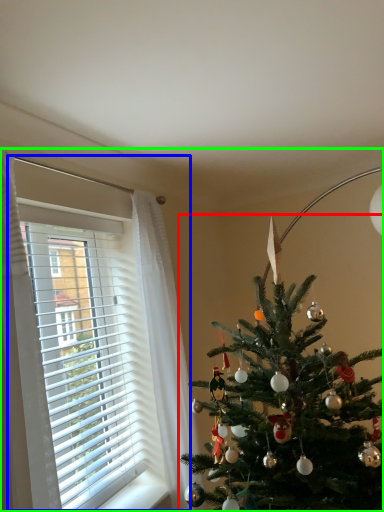
Question: Which object is the farthest from christmas tree (highlighted by a red box)? Choose among these: window (highlighted by a blue box) or christmas eve (highlighted by a green box).

Choices:
 (A) window
 (B) christmas eve

Answer: (B)